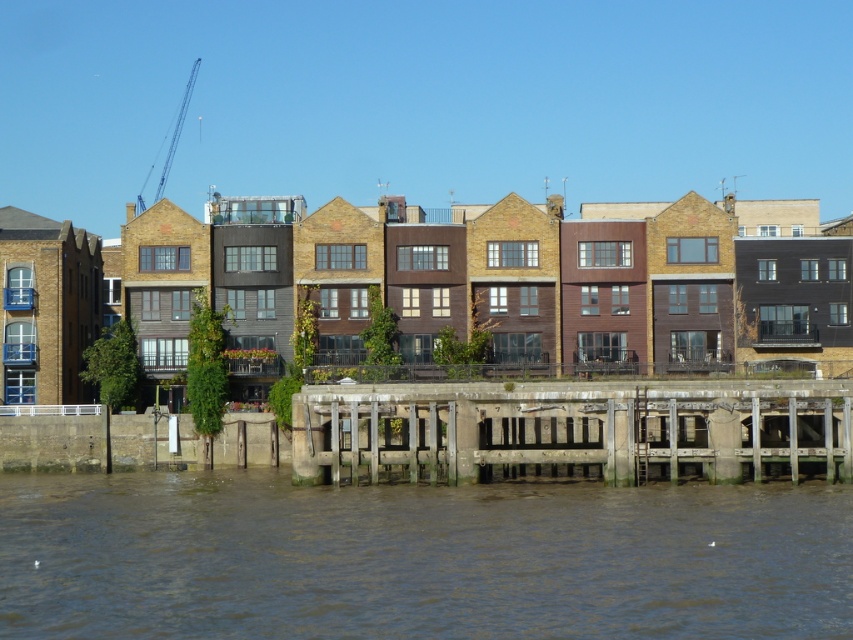
Question: Which point is farther to the camera?

Choices:
 (A) blue metallic crane at upper left
 (B) wooden planks at lower center
 (C) brown muddy water at lower center

Answer: (A)

Question: Where is wooden planks at lower center located in relation to blue metallic crane at upper left in the image?

Choices:
 (A) below
 (B) above

Answer: (A)

Question: Can you confirm if wooden planks at lower center is positioned to the left of blue metallic crane at upper left?

Choices:
 (A) no
 (B) yes

Answer: (A)

Question: Among these points, which one is nearest to the camera?

Choices:
 (A) (297, 600)
 (B) (177, 145)

Answer: (A)

Question: Which object is the farthest from the brown muddy water at lower center?

Choices:
 (A) blue metallic crane at upper left
 (B) wooden planks at lower center

Answer: (A)

Question: Considering the relative positions of brown muddy water at lower center and blue metallic crane at upper left in the image provided, where is brown muddy water at lower center located with respect to blue metallic crane at upper left?

Choices:
 (A) above
 (B) below

Answer: (B)